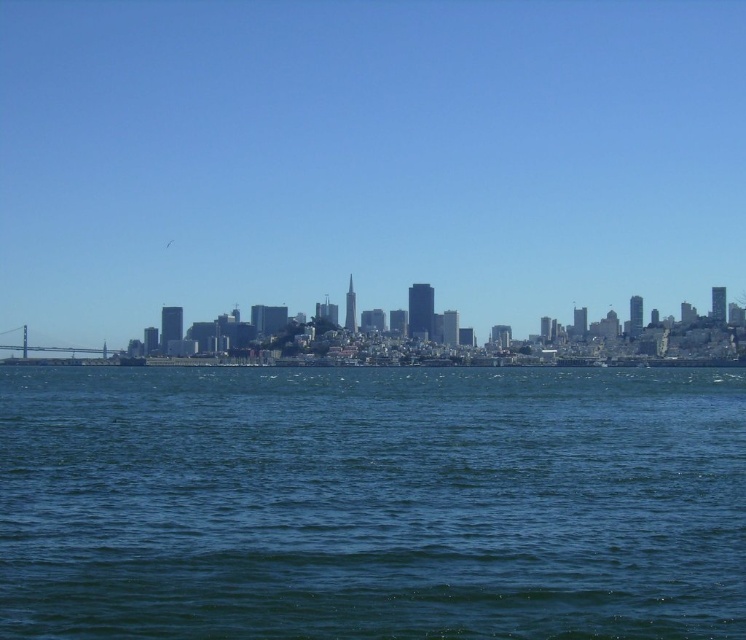
Is transparent glass skyscrapers at center to the left of blue liquid water at center from the viewer's perspective?

Incorrect, transparent glass skyscrapers at center is not on the left side of blue liquid water at center.

Between transparent glass skyscrapers at center and blue liquid water at center, which one appears on the left side from the viewer's perspective?

blue liquid water at center is more to the left.

Is point (570, 144) positioned after point (565, 570)?

Yes.

The image size is (746, 640). I want to click on transparent glass skyscrapers at center, so click(366, 157).